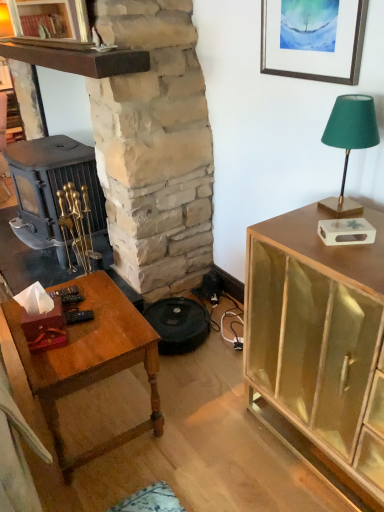
Locate an element on the screen. free space that is in between wooden table at lower left and matte gold cabinet at right is located at coordinates (204, 438).